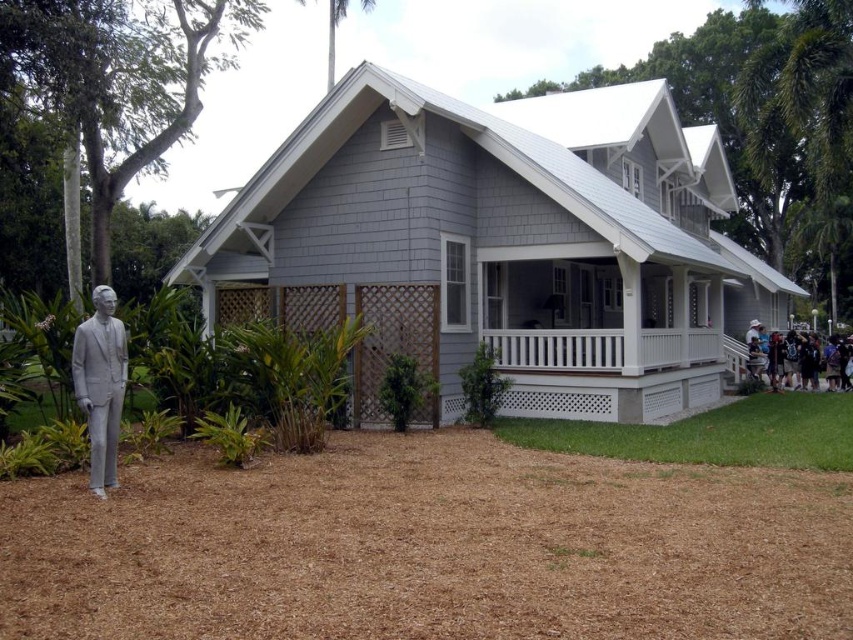
You are standing in front of the house and notice the white painted wood porch at center and the white cotton shirt at lower right. Which object is positioned higher relative to the other?

The white painted wood porch at center is above the white cotton shirt at lower right, so the porch is higher.

Consider the image. You are a delivery person arriving at the house. You need to place a package on the white painted wood porch at center and also hand a letter to someone wearing the white cotton shirt at lower right. Which object should you interact with first based on their height?

The white painted wood porch at center has a lesser height compared to the white cotton shirt at lower right, so you should place the package on the porch first since it is lower to the ground and easier to access before handing the letter to the person in the white cotton shirt at lower right.

You are standing in front of the house and want to reach the point marked at coordinates (x=543, y=364). How far will you have to walk to get there?

The point at coordinates (x=543, y=364) is 15.28 meters away from the viewer, so you will have to walk 15.28 meters to reach it.